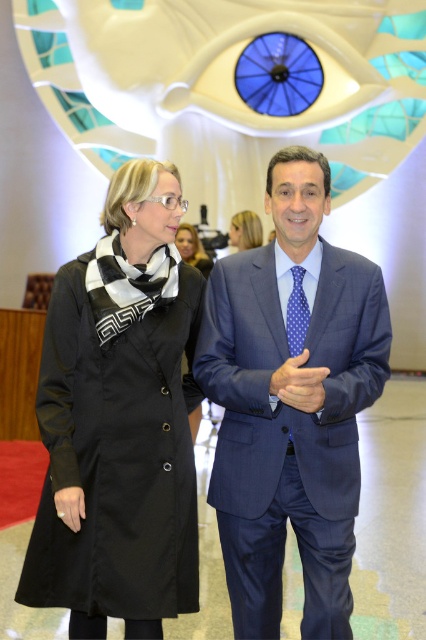
Question: Observing the image, what is the correct spatial positioning of blue dotted fabric at center in reference to blonde hair at upper center?

Choices:
 (A) right
 (B) left

Answer: (A)

Question: Considering the relative positions of black wool coat at left and blonde hair at upper center in the image provided, where is black wool coat at left located with respect to blonde hair at upper center?

Choices:
 (A) left
 (B) right

Answer: (A)

Question: Which point appears farthest from the camera in this image?

Choices:
 (A) (192, 417)
 (B) (298, 442)
 (C) (126, 412)
 (D) (287, 342)

Answer: (A)

Question: Estimate the real-world distances between objects in this image. Which object is closer to the black matte hand at lower left?

Choices:
 (A) matte blue suit at center
 (B) blonde hair at upper center
 (C) blue polished suit at center
 (D) blue dotted tie at center

Answer: (C)

Question: Which object is closer to the camera taking this photo?

Choices:
 (A) blue dotted tie at center
 (B) blonde hair at upper center

Answer: (A)

Question: Is black matte coat at center further to camera compared to black matte hand at lower left?

Choices:
 (A) no
 (B) yes

Answer: (B)